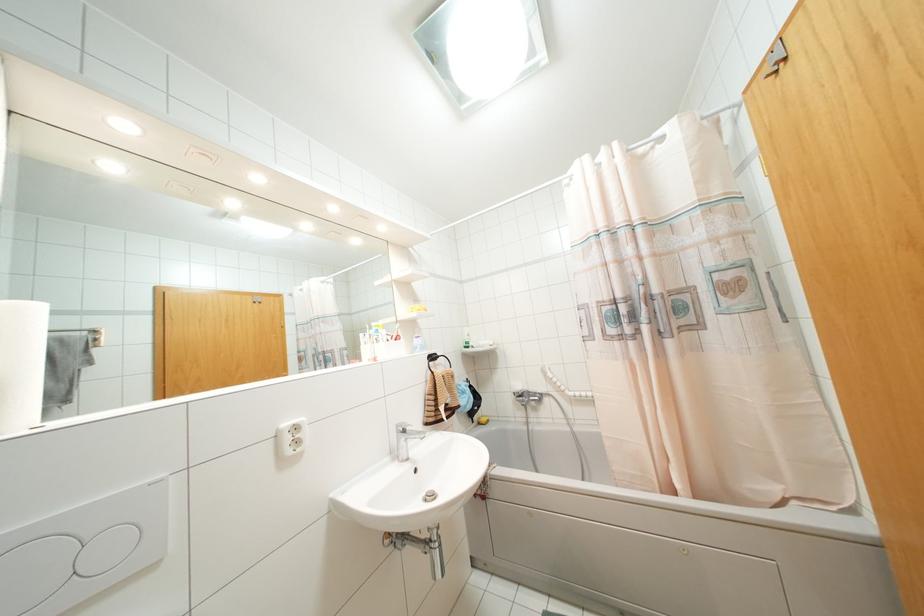
The width and height of the screenshot is (924, 616). What do you see at coordinates (405, 428) in the screenshot?
I see `a silver faucet handle` at bounding box center [405, 428].